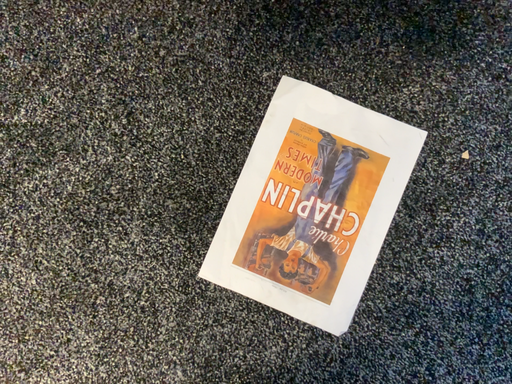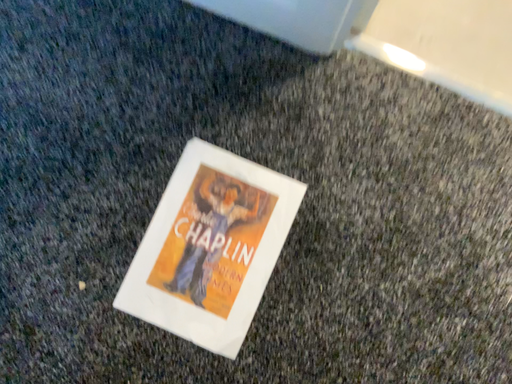
Question: How did the camera likely rotate when shooting the video?

Choices:
 (A) rotated upward
 (B) rotated downward

Answer: (A)